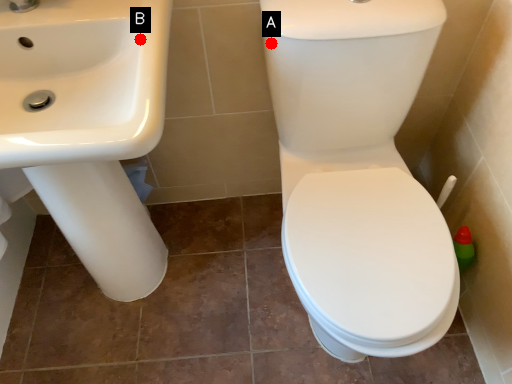
Question: Two points are circled on the image, labeled by A and B beside each circle. Which point appears closest to the camera in this image?

Choices:
 (A) A is closer
 (B) B is closer

Answer: (B)